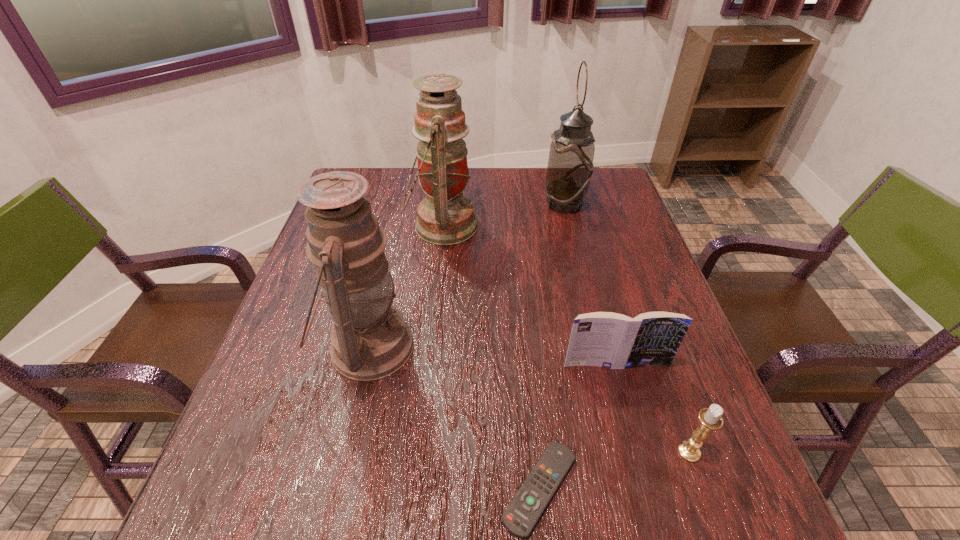
Select which object appears as the closest to the rightmost oil lamp. Please provide its 2D coordinates. Your answer should be formatted as a tuple, i.e. [(x, y)], where the tuple contains the x and y coordinates of a point satisfying the conditions above.

[(445, 217)]

Identify the location of object that stands as the third closest to the book. The width and height of the screenshot is (960, 540). (370, 340).

Image resolution: width=960 pixels, height=540 pixels. What are the coordinates of `oil lamp that is the second nearest to the rightmost oil lamp` in the screenshot? It's located at (370, 340).

Identify which oil lamp is the second nearest to the nearest oil lamp. Please provide its 2D coordinates. Your answer should be formatted as a tuple, i.e. [(x, y)], where the tuple contains the x and y coordinates of a point satisfying the conditions above.

[(570, 167)]

Identify the location of free spot that satisfies the following two spatial constraints: 1. on the back side of the rightmost oil lamp; 2. on the left side of the nearest oil lamp. This screenshot has width=960, height=540. (401, 204).

Locate an element on the screen. The image size is (960, 540). vacant region that satisfies the following two spatial constraints: 1. on the back side of the candle holder; 2. on the right side of the remote control is located at coordinates coord(537,451).